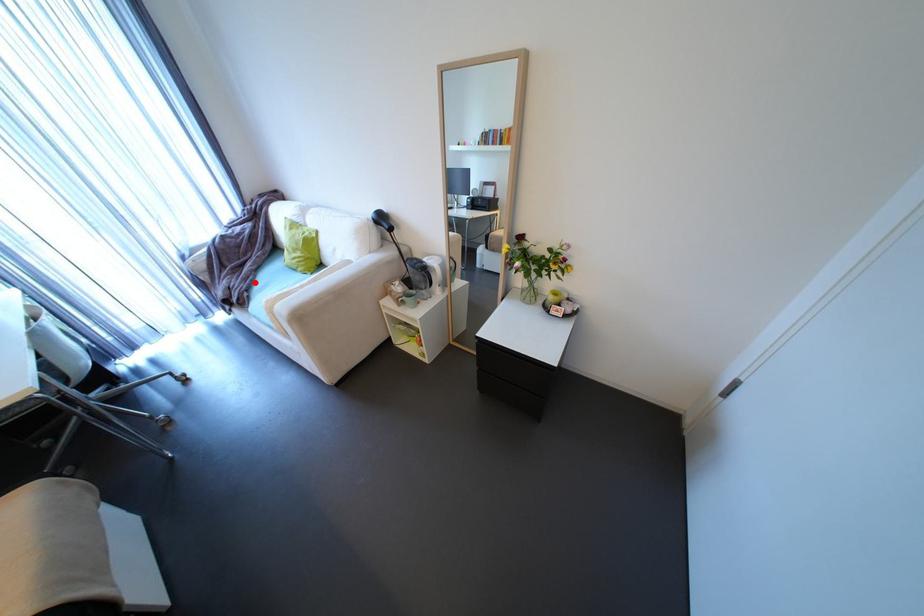
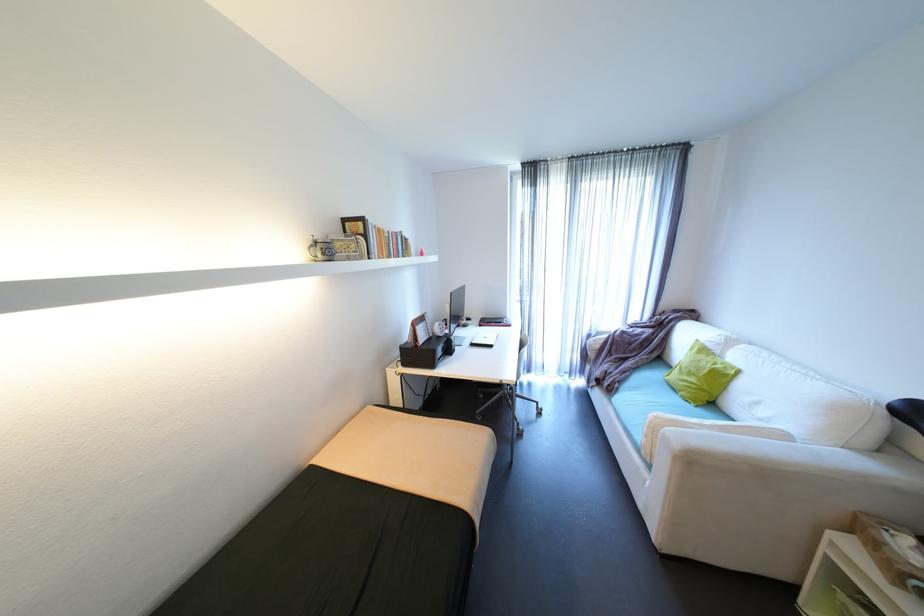
Question: I am providing you with two images of the same scene from different viewpoints. Given a red point in image1, look at the same physical point in image2. Is it:

Choices:
 (A) Closer to the viewpoint
 (B) Farther from the viewpoint

Answer: (A)